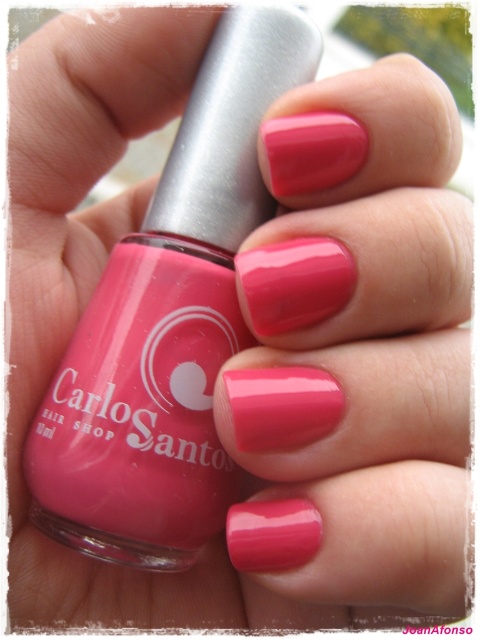
Question: Does glossy pink nails at center appear over matte pink nail polish at center?

Choices:
 (A) no
 (B) yes

Answer: (A)

Question: Which point is closer to the camera?

Choices:
 (A) (425, 413)
 (B) (211, 92)

Answer: (A)

Question: From the image, what is the correct spatial relationship of glossy pink nails at center in relation to matte pink nail polish at center?

Choices:
 (A) left
 (B) right

Answer: (B)

Question: Is glossy pink nails at center further to camera compared to matte pink nail polish at center?

Choices:
 (A) yes
 (B) no

Answer: (B)

Question: Which of the following is the closest to the observer?

Choices:
 (A) (359, 237)
 (B) (230, 164)

Answer: (A)

Question: Which object is closer to the camera taking this photo?

Choices:
 (A) matte pink nail polish at center
 (B) glossy pink nails at center

Answer: (B)